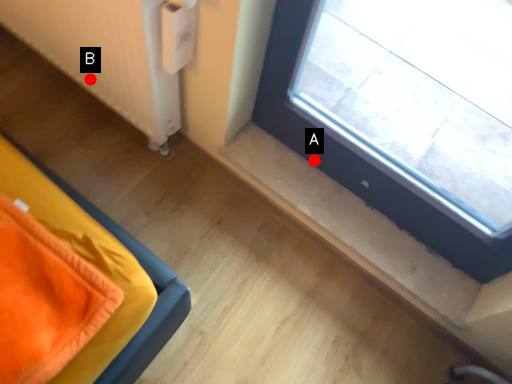
Question: Two points are circled on the image, labeled by A and B beside each circle. Which point is closer to the camera?

Choices:
 (A) A is closer
 (B) B is closer

Answer: (A)